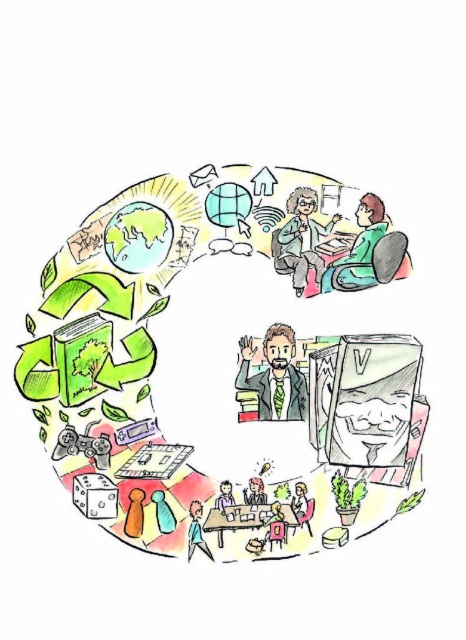
Who is more distant from viewer, (362, 484) or (274, 413)?

Point (274, 413)

This screenshot has width=466, height=640. I want to click on smooth wooden desk at center, so click(x=224, y=369).

Who is more forward, (281,496) or (239,342)?

Point (281,496) is in front.

Find the location of a particular element. The image size is (466, 640). smooth wooden desk at center is located at coordinates click(x=224, y=369).

Can you confirm if brown textured suit at center is taller than green fabric jacket at upper right?

In fact, brown textured suit at center may be shorter than green fabric jacket at upper right.

Who is shorter, brown textured suit at center or green fabric jacket at upper right?

Answer: brown textured suit at center is shorter.

Where is `brown textured suit at center`? The width and height of the screenshot is (466, 640). brown textured suit at center is located at coordinates (274, 376).

From the picture: Is smooth wooden desk at center thinner than green fabric jacket at upper right?

No.

Does smooth wooden desk at center have a greater width compared to green fabric jacket at upper right?

Indeed, smooth wooden desk at center has a greater width compared to green fabric jacket at upper right.

This screenshot has height=640, width=466. What do you see at coordinates (224, 369) in the screenshot? I see `smooth wooden desk at center` at bounding box center [224, 369].

The height and width of the screenshot is (640, 466). Identify the location of smooth wooden desk at center. (224, 369).